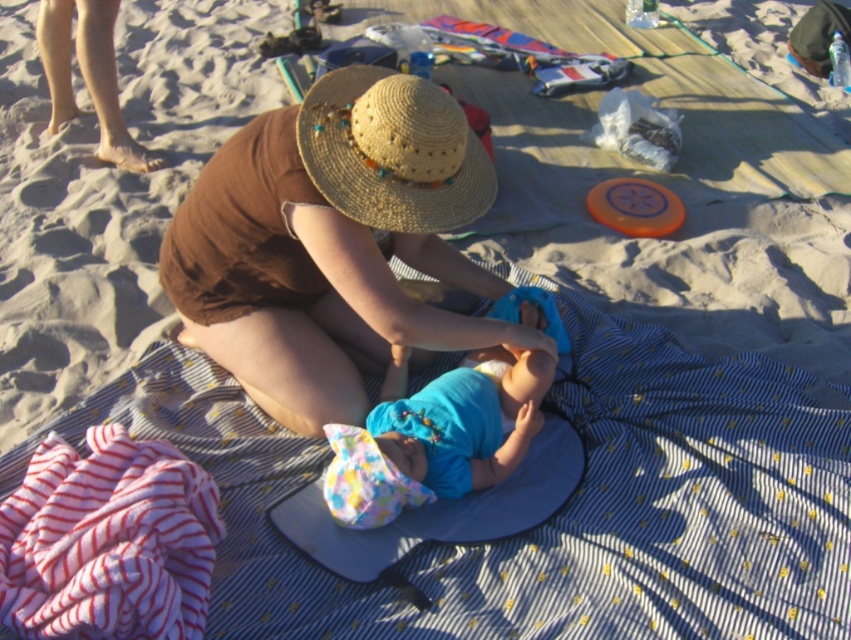
Question: Does brown straw hat at center have a lesser width compared to striped cotton towel at lower left?

Choices:
 (A) yes
 (B) no

Answer: (B)

Question: Which point is farther from the camera taking this photo?

Choices:
 (A) (129, 566)
 (B) (497, 394)
 (C) (443, 257)
 (D) (375, 70)

Answer: (C)

Question: Which of the following is the farthest from the observer?

Choices:
 (A) (420, 390)
 (B) (464, 115)
 (C) (426, 244)
 (D) (163, 628)

Answer: (C)

Question: Which point is farther from the camera taking this photo?

Choices:
 (A) (101, 618)
 (B) (420, 100)
 (C) (412, 115)

Answer: (B)

Question: Is blue fabric baby at center bigger than straw hat at center?

Choices:
 (A) no
 (B) yes

Answer: (B)

Question: Does striped cotton towel at lower left appear on the right side of blue fabric baby at center?

Choices:
 (A) yes
 (B) no

Answer: (B)